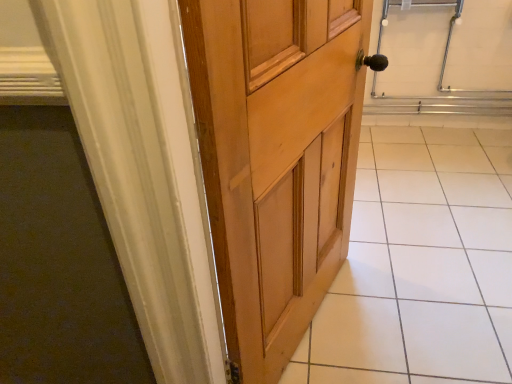
In order to click on metallic silver elevator at upper right in this screenshot , I will do `click(443, 60)`.

Based on the photo, measure the distance between point (377, 18) and camera.

The distance of point (377, 18) from camera is 2.34 meters.

The width and height of the screenshot is (512, 384). What do you see at coordinates (443, 60) in the screenshot?
I see `metallic silver elevator at upper right` at bounding box center [443, 60].

Measure the distance between metallic silver elevator at upper right and camera.

The distance of metallic silver elevator at upper right from camera is 7.24 feet.

The image size is (512, 384). I want to click on metallic silver elevator at upper right, so coord(443,60).